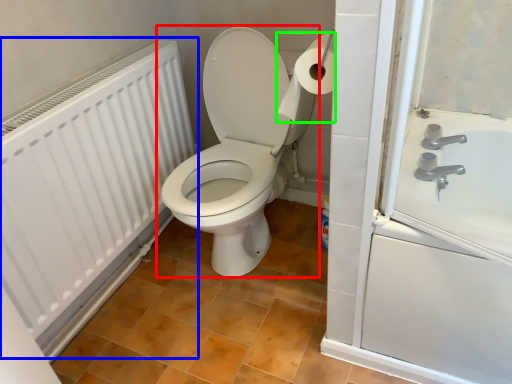
Question: Considering the real-world distances, which object is closest to toilet (highlighted by a red box)? radiator (highlighted by a blue box) or toilet paper (highlighted by a green box).

Choices:
 (A) radiator
 (B) toilet paper

Answer: (A)